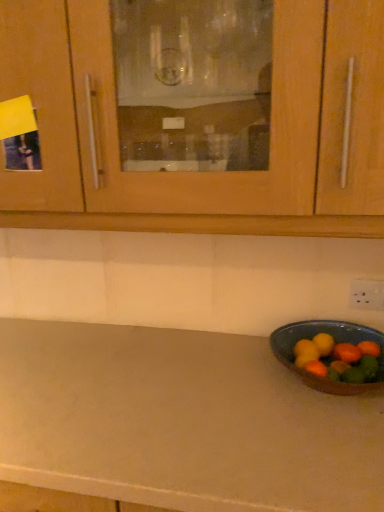
Question: Should I look upward or downward to see orange matte/orange at right?

Choices:
 (A) down
 (B) up

Answer: (A)

Question: From a real-world perspective, is wooden cabinet at upper center physically above orange matte/orange at right?

Choices:
 (A) yes
 (B) no

Answer: (A)

Question: Is wooden cabinet at upper center taller than orange matte/orange at right?

Choices:
 (A) yes
 (B) no

Answer: (A)

Question: Are wooden cabinet at upper center and orange matte/orange at right located far from each other?

Choices:
 (A) yes
 (B) no

Answer: (B)

Question: Does wooden cabinet at upper center come behind orange matte/orange at right?

Choices:
 (A) no
 (B) yes

Answer: (A)

Question: Is orange matte/orange at right inside wooden cabinet at upper center?

Choices:
 (A) no
 (B) yes

Answer: (A)

Question: Does wooden cabinet at upper center have a larger size compared to orange matte/orange at right?

Choices:
 (A) no
 (B) yes

Answer: (B)

Question: Would you say orange matte/orange at right is a long distance from wooden cabinet at upper center?

Choices:
 (A) no
 (B) yes

Answer: (A)

Question: Does orange matte/orange at right have a lesser width compared to wooden cabinet at upper center?

Choices:
 (A) yes
 (B) no

Answer: (A)

Question: From a real-world perspective, is orange matte/orange at right under wooden cabinet at upper center?

Choices:
 (A) yes
 (B) no

Answer: (A)

Question: Can you confirm if orange matte/orange at right is smaller than wooden cabinet at upper center?

Choices:
 (A) yes
 (B) no

Answer: (A)

Question: Is orange matte/orange at right in contact with wooden cabinet at upper center?

Choices:
 (A) yes
 (B) no

Answer: (B)

Question: Can you confirm if orange matte/orange at right is positioned to the right of wooden cabinet at upper center?

Choices:
 (A) yes
 (B) no

Answer: (A)

Question: From a real-world perspective, is wooden cabinet at upper center above or below orange matte/orange at right?

Choices:
 (A) below
 (B) above

Answer: (B)